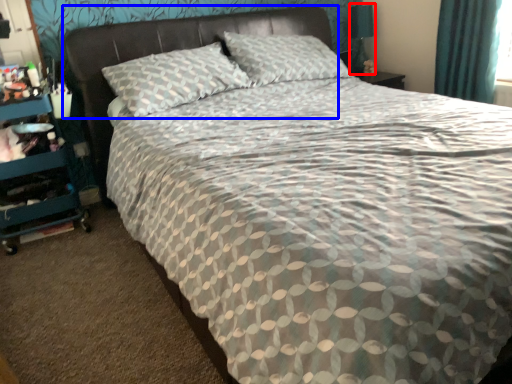
Question: Which object is further to the camera taking this photo, table lamp (highlighted by a red box) or headboard (highlighted by a blue box)?

Choices:
 (A) table lamp
 (B) headboard

Answer: (A)